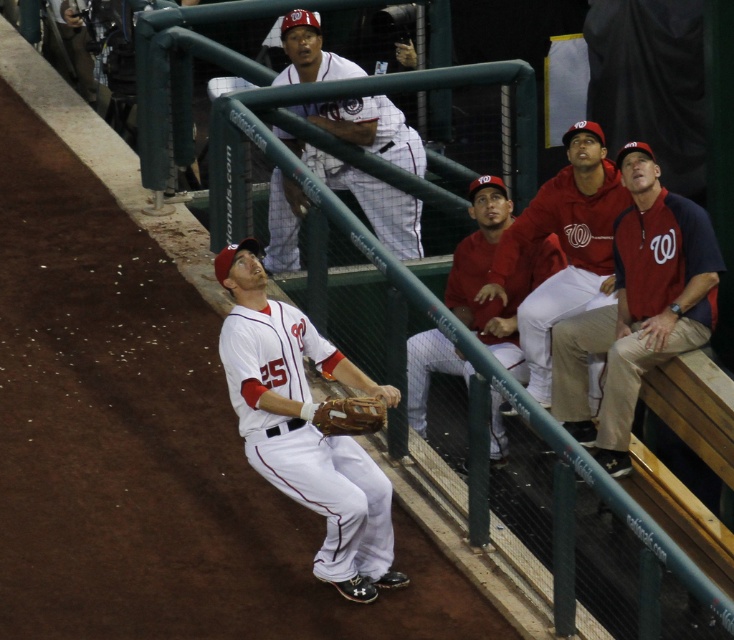
You are a photographer trying to capture a photo of the white matte baseball glove at center and the green metal rail at upper center. If you want to focus on the glove first, which object should you adjust your camera to focus on first?

The green metal rail at upper center is further to the viewer than the white matte baseball glove at center, so you should focus on the green metal rail at upper center first before adjusting to the glove.

You are a photographer positioned at the center of the dugout. You need to capture a photo of the green metal rail at upper center. According to the coordinates provided, where should you aim your camera?

The green metal rail at upper center is located at point (446, 310), so aim your camera at those coordinates to capture it.